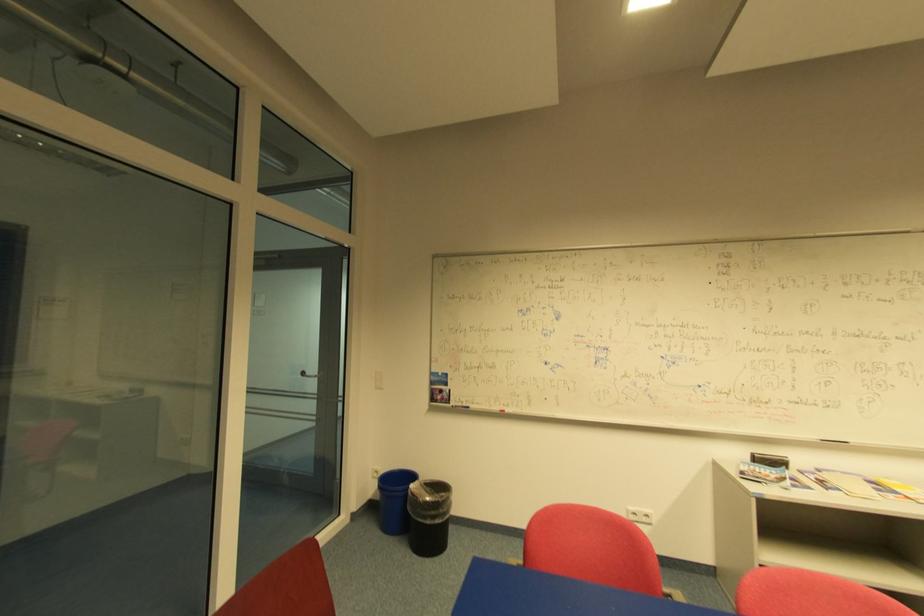
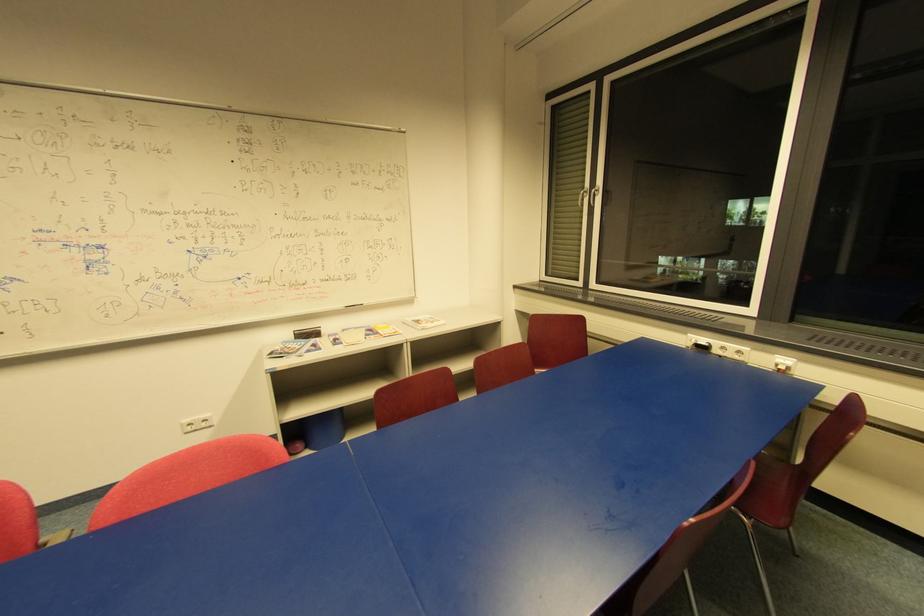
Where in the second image is the point corresponding to pixel 784 461 from the first image?

(319, 331)